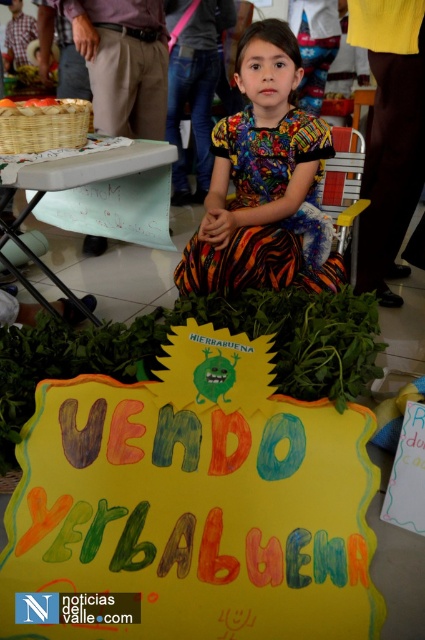
You are a photographer setting up for a photo shoot. You need to position a light source so that it illuminates the multicolored fabric dress at center and the green painted plastic table at lower left equally. Based on their positions, where should you place the light source relative to the two objects?

The multicolored fabric dress at center is located above the green painted plastic table at lower left, so placing the light source directly in front and slightly below the dress would ensure both objects receive equal illumination.